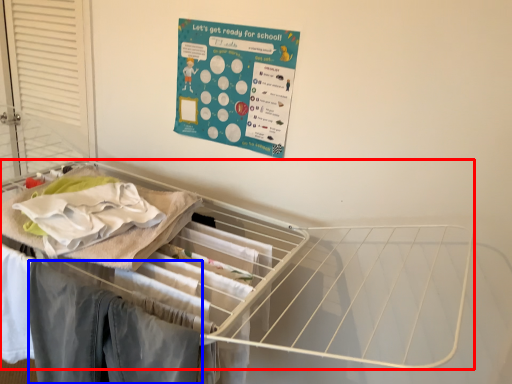
Question: Which object appears farthest to the camera in this image, furniture (highlighted by a red box) or clothing (highlighted by a blue box)?

Choices:
 (A) furniture
 (B) clothing

Answer: (B)